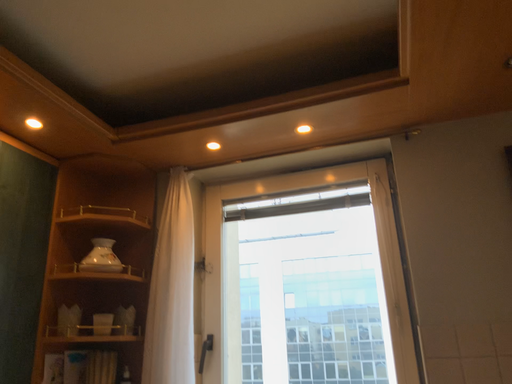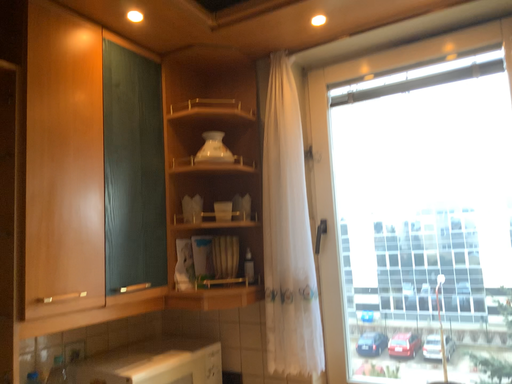
Question: Which way did the camera rotate in the video?

Choices:
 (A) rotated upward
 (B) rotated downward

Answer: (B)